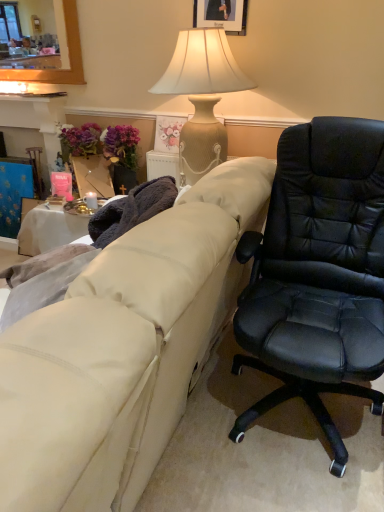
What do you see at coordinates (126, 346) in the screenshot? The image size is (384, 512). I see `beige fabric couch at center` at bounding box center [126, 346].

You are a GUI agent. You are given a task and a screenshot of the screen. Output one action in this format:
    pyautogui.click(x=<x>, y=<y>)
    Task: Click on the beige fabric couch at center
    
    Given the screenshot: What is the action you would take?
    pyautogui.click(x=126, y=346)

From the image's perspective, is beige textured lamp at upper center above wooden picture frame at upper center?

No.

Which object is wider, beige textured lamp at upper center or wooden picture frame at upper center?

beige textured lamp at upper center is wider.

From a real-world perspective, is beige textured lamp at upper center physically above wooden picture frame at upper center?

No, from a real-world perspective, beige textured lamp at upper center is not over wooden picture frame at upper center

Is beige fabric couch at center wider than beige textured lamp at upper center?

Yes.

Consider the image. Considering the relative sizes of beige fabric couch at center and beige textured lamp at upper center in the image provided, is beige fabric couch at center shorter than beige textured lamp at upper center?

Incorrect, the height of beige fabric couch at center does not fall short of that of beige textured lamp at upper center.

Is beige fabric couch at center looking in the opposite direction of beige textured lamp at upper center?

No, beige textured lamp at upper center is not at the back of beige fabric couch at center.

Is point (65, 296) closer to viewer compared to point (195, 88)?

Yes, point (65, 296) is closer to viewer.

Is purple fabric at left spatially inside beige fabric couch at center, or outside of it?

purple fabric at left is not enclosed by beige fabric couch at center.

Who is shorter, purple fabric at left or beige fabric couch at center?

purple fabric at left is shorter.

Is purple fabric at left to the left of beige fabric couch at center from the viewer's perspective?

Yes, purple fabric at left is to the left of beige fabric couch at center.

Looking at this image, considering the relative positions of purple fabric at left and wooden picture frame at upper center in the image provided, is purple fabric at left to the right of wooden picture frame at upper center from the viewer's perspective?

Incorrect, purple fabric at left is not on the right side of wooden picture frame at upper center.

Based on the photo, is purple fabric at left aimed at wooden picture frame at upper center?

No, purple fabric at left is not turned towards wooden picture frame at upper center.

From a real-world perspective, relative to wooden picture frame at upper center, is purple fabric at left vertically above or below?

purple fabric at left is below wooden picture frame at upper center.

Who is taller, purple fabric at left or wooden picture frame at upper center?

With more height is purple fabric at left.

In order to click on houseplant that appears above the beige fabric couch at center (from the image's perspective) in this screenshot , I will do `click(104, 154)`.

Can you tell me how much beige fabric couch at center and purple fabric at left differ in facing direction?

There is a 90.8-degree angle between the facing directions of beige fabric couch at center and purple fabric at left.

From the image's perspective, does beige fabric couch at center appear lower than purple fabric at left?

Yes, from the image's perspective, beige fabric couch at center is beneath purple fabric at left.

The height and width of the screenshot is (512, 384). In the image, there is a purple fabric at left. Identify the location of lamp above it (from the image's perspective). (202, 96).

Which of these two, purple fabric at left or beige textured lamp at upper center, is smaller?

purple fabric at left.

Considering their positions, is purple fabric at left located in front of or behind beige textured lamp at upper center?

purple fabric at left is behind beige textured lamp at upper center.

Considering the sizes of objects purple fabric at left and beige textured lamp at upper center in the image provided, who is wider, purple fabric at left or beige textured lamp at upper center?

With larger width is beige textured lamp at upper center.

Is wooden picture frame at upper center positioned beyond the bounds of beige textured lamp at upper center?

Yes, wooden picture frame at upper center is located beyond the bounds of beige textured lamp at upper center.

From a real-world perspective, which object stands above the other?

In real-world perspective, wooden picture frame at upper center is above.

At what (x,y) coordinates should I click in order to perform the action: click on lamp that is below the wooden picture frame at upper center (from the image's perspective). Please return your answer as a coordinate pair (x, y). This screenshot has height=512, width=384. Looking at the image, I should click on (202, 96).

Considering the relative sizes of wooden picture frame at upper center and beige textured lamp at upper center in the image provided, is wooden picture frame at upper center taller than beige textured lamp at upper center?

In fact, wooden picture frame at upper center may be shorter than beige textured lamp at upper center.

This screenshot has height=512, width=384. Find the location of `picture frame located above the beige textured lamp at upper center (from the image's perspective)`. picture frame located above the beige textured lamp at upper center (from the image's perspective) is located at coordinates click(x=222, y=14).

Where is `lamp located above the beige fabric couch at center (from a real-world perspective)`? The image size is (384, 512). lamp located above the beige fabric couch at center (from a real-world perspective) is located at coordinates (202, 96).

Looking at this image, considering their positions, is wooden picture frame at upper center positioned closer to beige textured lamp at upper center than purple fabric at left?

wooden picture frame at upper center lies closer to beige textured lamp at upper center than the other object.

Looking at the image, which one is located further to beige textured lamp at upper center, beige fabric couch at center or wooden picture frame at upper center?

beige fabric couch at center is further to beige textured lamp at upper center.

Looking at the image, which one is located further to beige textured lamp at upper center, beige fabric couch at center or purple fabric at left?

beige fabric couch at center lies further to beige textured lamp at upper center than the other object.

Considering their positions, is wooden picture frame at upper center positioned closer to purple fabric at left than beige textured lamp at upper center?

beige textured lamp at upper center is closer to purple fabric at left.

Estimate the real-world distances between objects in this image. Which object is closer to beige fabric couch at center, beige textured lamp at upper center or purple fabric at left?

beige textured lamp at upper center.

Based on their spatial positions, is beige fabric couch at center or beige textured lamp at upper center further from purple fabric at left?

The object further to purple fabric at left is beige fabric couch at center.

When comparing their distances from beige fabric couch at center, does purple fabric at left or wooden picture frame at upper center seem further?

wooden picture frame at upper center.

Based on their spatial positions, is purple fabric at left or beige fabric couch at center further from wooden picture frame at upper center?

beige fabric couch at center lies further to wooden picture frame at upper center than the other object.

Find the location of `lamp between beige fabric couch at center and wooden picture frame at upper center along the z-axis`. lamp between beige fabric couch at center and wooden picture frame at upper center along the z-axis is located at coordinates (202, 96).

Locate an element on the screen. picture frame between beige fabric couch at center and purple fabric at left along the z-axis is located at coordinates (222, 14).

Identify the location of lamp that lies between wooden picture frame at upper center and purple fabric at left from top to bottom. The image size is (384, 512). (202, 96).

Locate an element on the screen. This screenshot has width=384, height=512. lamp located between beige fabric couch at center and purple fabric at left in the depth direction is located at coordinates (202, 96).